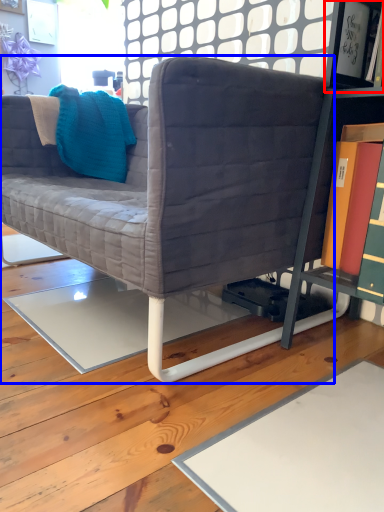
Question: Which point is closer to the camera, shelf (highlighted by a red box) or studio couch (highlighted by a blue box)?

Choices:
 (A) shelf
 (B) studio couch

Answer: (B)